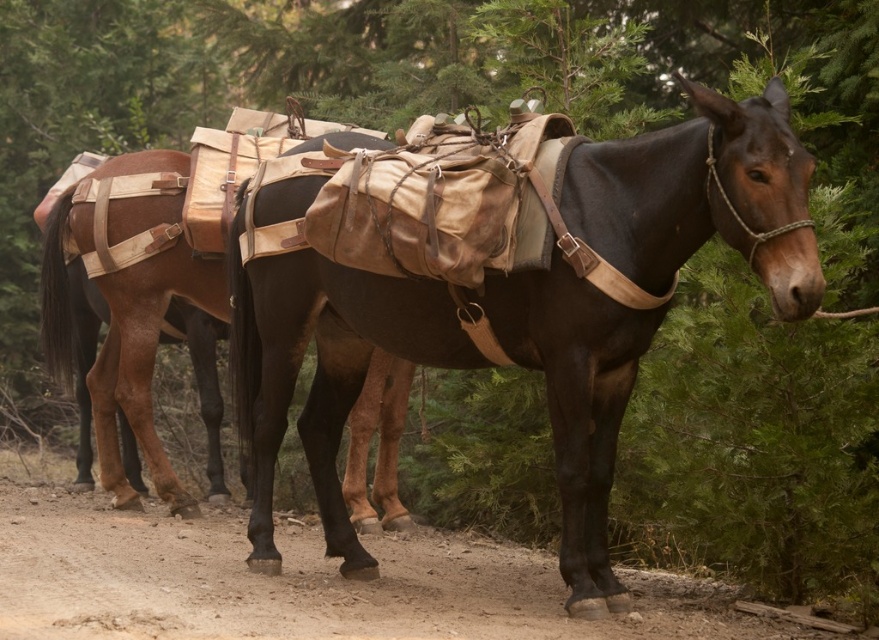
Question: Which object is closer to the camera taking this photo?

Choices:
 (A) dusty brown dirt track at center
 (B) brown leather saddle at center

Answer: (B)

Question: Can you confirm if brown leather saddle at center is positioned above dusty brown dirt track at center?

Choices:
 (A) yes
 (B) no

Answer: (A)

Question: Is the position of brown leather saddle at center less distant than that of dusty brown dirt track at center?

Choices:
 (A) yes
 (B) no

Answer: (A)

Question: Does brown leather saddle at center have a smaller size compared to dusty brown dirt track at center?

Choices:
 (A) no
 (B) yes

Answer: (A)

Question: Which of the following is the closest to the observer?

Choices:
 (A) dusty brown dirt track at center
 (B) brown leather saddle at center

Answer: (B)